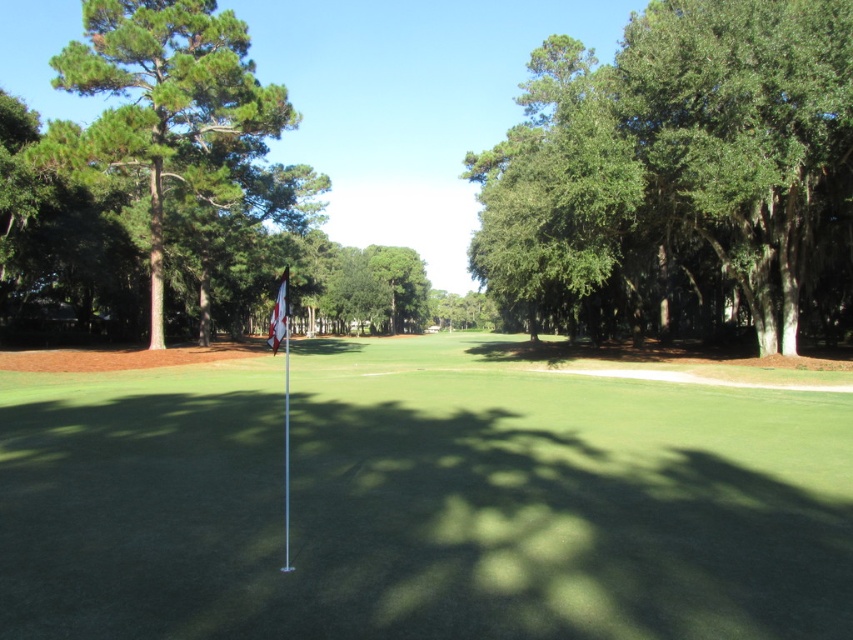
Question: Among these points, which one is farthest from the camera?

Choices:
 (A) (280, 289)
 (B) (166, 17)
 (C) (514, 220)
 (D) (33, 589)

Answer: (C)

Question: Which of these objects is positioned farthest from the white fabric flag at center?

Choices:
 (A) green leafy tree at right
 (B) green artificial turf at center

Answer: (A)

Question: Can you confirm if green artificial turf at center is positioned to the right of green textured tree at left?

Choices:
 (A) yes
 (B) no

Answer: (A)

Question: Does green leafy tree at right have a greater width compared to white fabric flag at center?

Choices:
 (A) yes
 (B) no

Answer: (A)

Question: Does green artificial turf at center have a larger size compared to green leafy tree at right?

Choices:
 (A) no
 (B) yes

Answer: (A)

Question: Which point appears farthest from the camera in this image?

Choices:
 (A) (283, 300)
 (B) (263, 140)

Answer: (B)